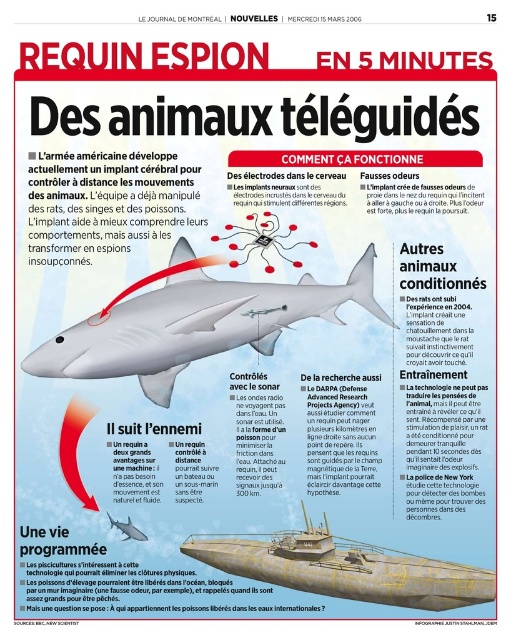
Who is shorter, brushed metal submarine at lower center or matte black shark at lower left?

matte black shark at lower left is shorter.

Who is more distant from viewer, (476,568) or (127,528)?

The point (127,528) is more distant.

At what (x,y) coordinates should I click in order to perform the action: click on brushed metal submarine at lower center. Please return your answer as a coordinate pair (x, y). This screenshot has width=521, height=640. Looking at the image, I should click on (343, 566).

Is point (366, 307) farther from camera compared to point (311, 545)?

Yes.

Is matte black shark at center smaller than brushed metal submarine at lower center?

No, matte black shark at center is not smaller than brushed metal submarine at lower center.

Describe the element at coordinates (193, 323) in the screenshot. I see `matte black shark at center` at that location.

This screenshot has width=521, height=640. I want to click on matte black shark at center, so click(x=193, y=323).

Which is in front, point (244, 307) or point (125, 536)?

Point (125, 536) is in front.

Is point (111, 369) positioned after point (146, 538)?

That is True.

Find the location of a particular element. Image resolution: width=521 pixels, height=640 pixels. matte black shark at center is located at coordinates (193, 323).